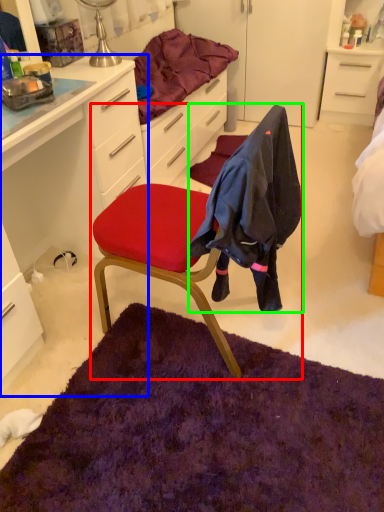
Question: Estimate the real-world distances between objects in this image. Which object is closer to chair (highlighted by a red box), cabinetry (highlighted by a blue box) or clothing (highlighted by a green box)?

Choices:
 (A) cabinetry
 (B) clothing

Answer: (B)